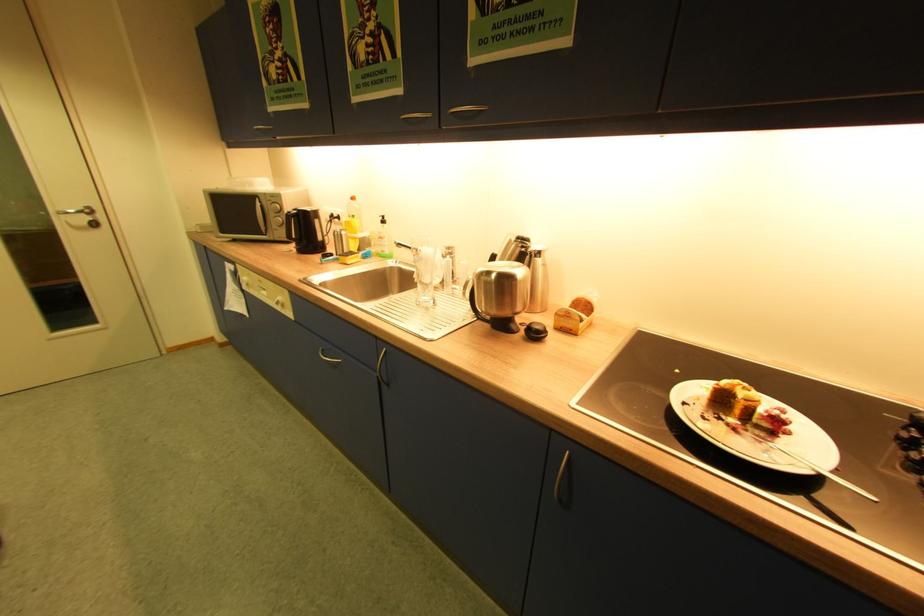
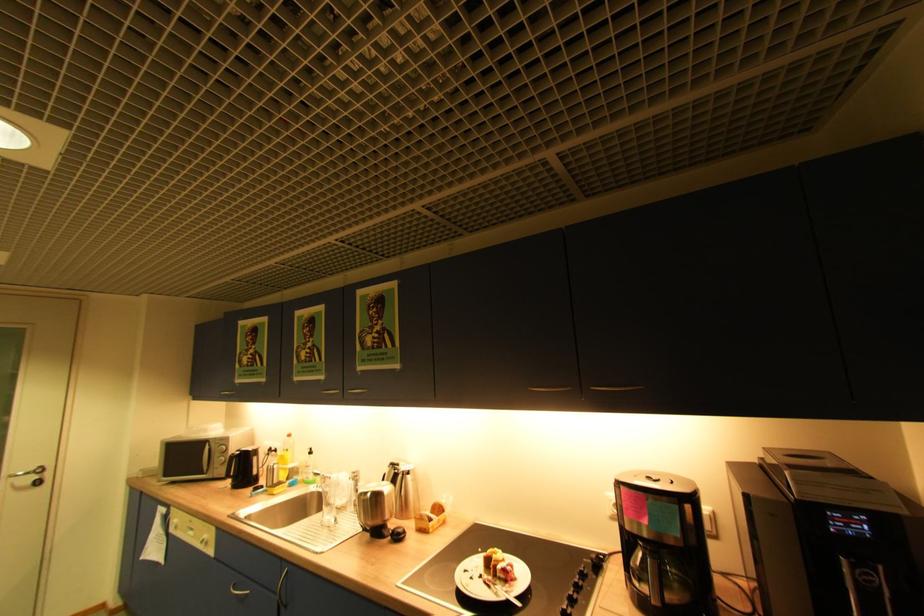
Question: Based on the continuous images, in which direction is the camera rotating? Reply with the corresponding letter.

Choices:
 (A) Left
 (B) Right
 (C) Up
 (D) Down

Answer: (C)